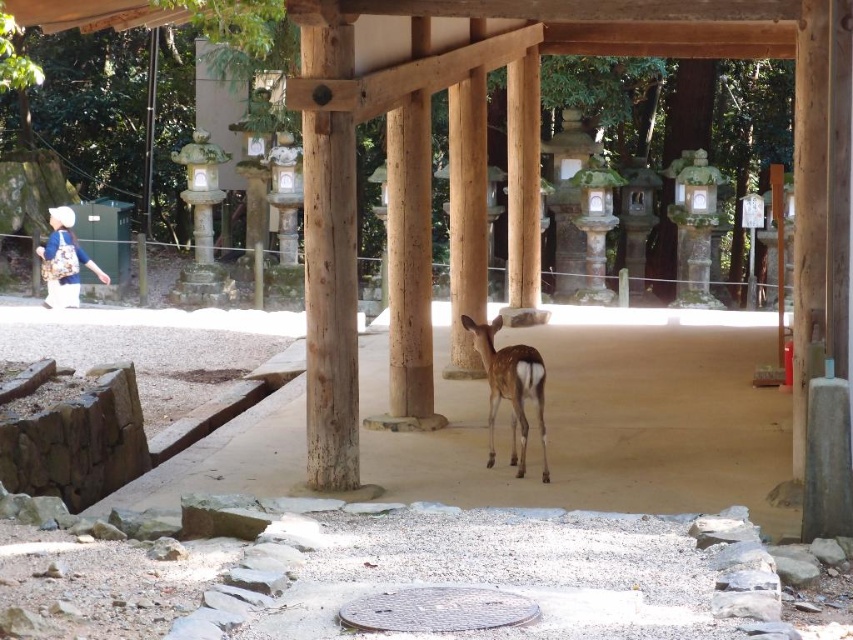
Question: Is natural wood pillar at center to the right of brown glossy deer at center from the viewer's perspective?

Choices:
 (A) no
 (B) yes

Answer: (A)

Question: Which point is closer to the camera?

Choices:
 (A) brown glossy deer at center
 (B) matte blue backpack at left

Answer: (A)

Question: Which of the following is the farthest from the observer?

Choices:
 (A) brown glossy deer at center
 (B) natural wood pillar at center

Answer: (A)

Question: In this image, where is natural wood pillar at center located relative to matte blue backpack at left?

Choices:
 (A) above
 (B) below

Answer: (B)

Question: Among these objects, which one is nearest to the camera?

Choices:
 (A) matte blue backpack at left
 (B) brown glossy deer at center

Answer: (B)

Question: Is natural wood pillar at center to the left of matte blue backpack at left from the viewer's perspective?

Choices:
 (A) yes
 (B) no

Answer: (B)